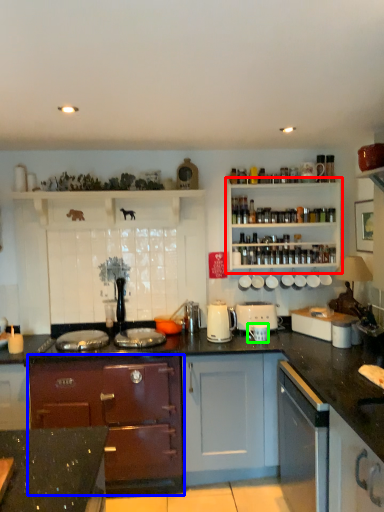
Question: Estimate the real-world distances between objects in this image. Which object is closer to shelf (highlighted by a red box), cabinetry (highlighted by a blue box) or appliance (highlighted by a green box)?

Choices:
 (A) cabinetry
 (B) appliance

Answer: (B)